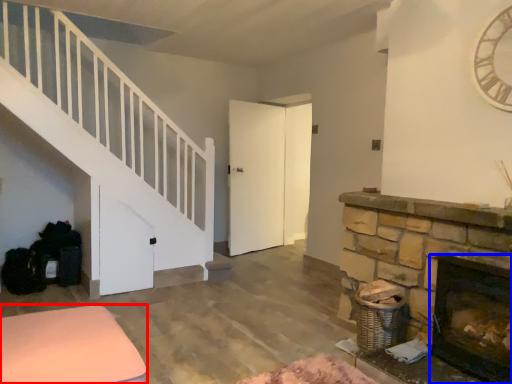
Question: Which point is closer to the camera, furniture (highlighted by a red box) or fireplace (highlighted by a blue box)?

Choices:
 (A) furniture
 (B) fireplace

Answer: (A)